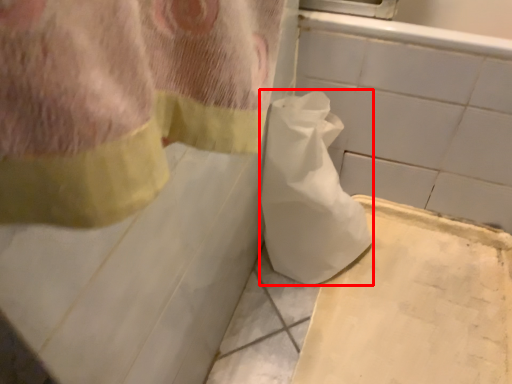
Question: From the image's perspective, where is toilet paper (annotated by the red box) located in relation to cardboard in the image?

Choices:
 (A) below
 (B) above

Answer: (B)